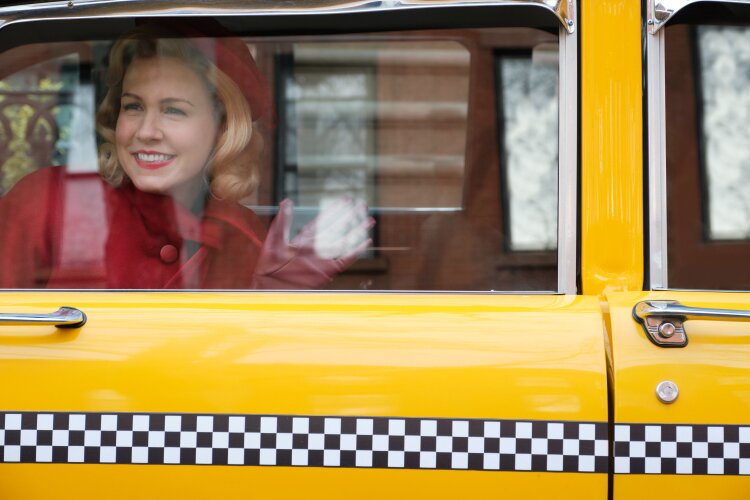
This screenshot has height=500, width=750. I want to click on key hole, so click(x=670, y=392).